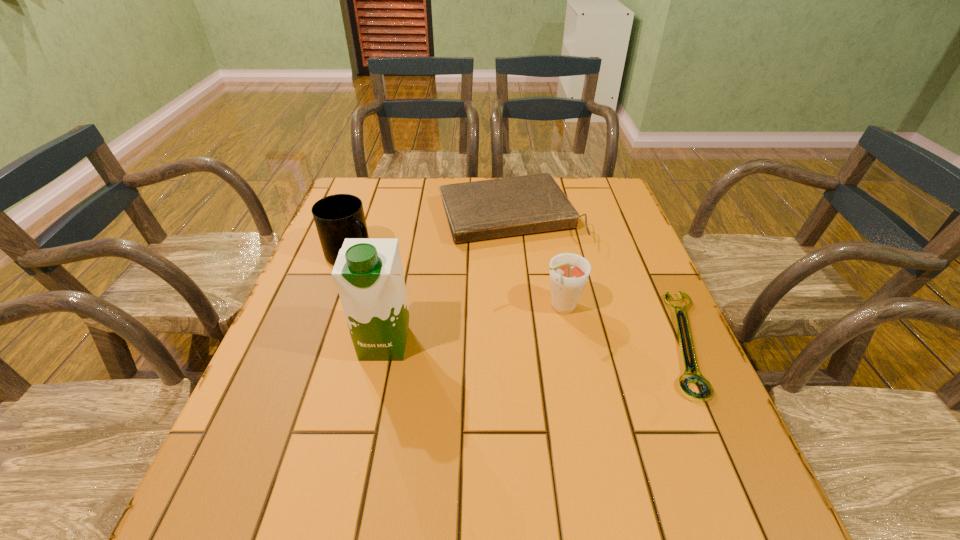
Find the location of a particular element. Image resolution: width=960 pixels, height=540 pixels. the tallest object is located at coordinates (368, 272).

Where is `soya milk`? soya milk is located at coordinates (368, 272).

Locate an element on the screen. the rightmost object is located at coordinates (697, 378).

Locate an element on the screen. wrench is located at coordinates (697, 378).

Identify the location of mug. This screenshot has width=960, height=540. (337, 217).

Locate an element on the screen. The height and width of the screenshot is (540, 960). the second shortest object is located at coordinates (478, 210).

At what (x,y) coordinates should I click in order to perform the action: click on root beer. Please return your answer as a coordinate pair (x, y). This screenshot has width=960, height=540. Looking at the image, I should click on (569, 272).

At what (x,y) coordinates should I click in order to perform the action: click on vacant point located on the front-facing side of the tallest object. Please return your answer as a coordinate pair (x, y). The width and height of the screenshot is (960, 540). Looking at the image, I should click on (369, 421).

Where is `free space located 0.350m on the back of the shortest object`? The height and width of the screenshot is (540, 960). free space located 0.350m on the back of the shortest object is located at coordinates (628, 217).

At what (x,y) coordinates should I click in order to perform the action: click on vacant region located 0.240m on the side of the mug with the handle. Please return your answer as a coordinate pair (x, y). This screenshot has width=960, height=540. Looking at the image, I should click on (432, 304).